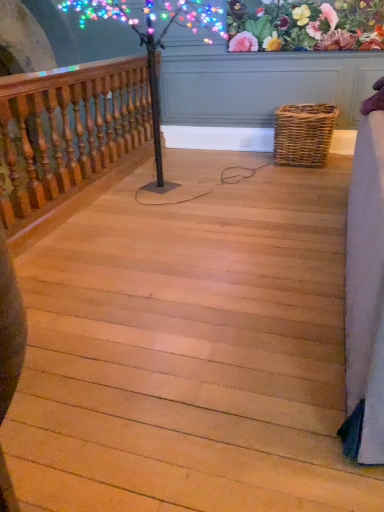
The height and width of the screenshot is (512, 384). What do you see at coordinates (190, 354) in the screenshot?
I see `light wood stairs at center` at bounding box center [190, 354].

What do you see at coordinates (303, 134) in the screenshot? I see `woven brown picnic basket at lower right` at bounding box center [303, 134].

Measure the distance between point (324, 31) and camera.

A distance of 3.51 meters exists between point (324, 31) and camera.

Locate an element on the screen. The image size is (384, 512). light wood stairs at center is located at coordinates (190, 354).

Based on the photo, which of these two, floral fabric at upper center or woven brown picnic basket at lower right, is thinner?

With smaller width is floral fabric at upper center.

Considering the sizes of objects floral fabric at upper center and woven brown picnic basket at lower right in the image provided, who is smaller, floral fabric at upper center or woven brown picnic basket at lower right?

Smaller between the two is floral fabric at upper center.

Visually, is floral fabric at upper center positioned to the left or to the right of woven brown picnic basket at lower right?

floral fabric at upper center is to the left of woven brown picnic basket at lower right.

Does woven brown picnic basket at lower right appear on the left side of wooden baluster at left?

No, woven brown picnic basket at lower right is not to the left of wooden baluster at left.

From the image's perspective, does woven brown picnic basket at lower right appear higher than wooden baluster at left?

Correct, woven brown picnic basket at lower right appears higher than wooden baluster at left in the image.

Considering the positions of objects woven brown picnic basket at lower right and wooden baluster at left in the image provided, who is behind, woven brown picnic basket at lower right or wooden baluster at left?

woven brown picnic basket at lower right is further away from the camera.

Is woven brown picnic basket at lower right wider than wooden baluster at left?

Indeed, woven brown picnic basket at lower right has a greater width compared to wooden baluster at left.

Can you confirm if wooden baluster at left is wider than light wood stairs at center?

No.

Identify the location of stairs in front of the wooden baluster at left. The height and width of the screenshot is (512, 384). (190, 354).

How many degrees apart are the facing directions of floral fabric at upper center and light wood stairs at center?

The angular difference between floral fabric at upper center and light wood stairs at center is 0.713 degrees.

Based on the photo, is floral fabric at upper center not close to light wood stairs at center?

floral fabric at upper center is far away from light wood stairs at center.

Is floral fabric at upper center inside the boundaries of light wood stairs at center, or outside?

floral fabric at upper center cannot be found inside light wood stairs at center.

In the image, is floral fabric at upper center on the left side or the right side of light wood stairs at center?

From the image, it's evident that floral fabric at upper center is to the right of light wood stairs at center.

What are the coordinates of `picnic basket above the wooden baluster at left (from the image's perspective)` in the screenshot? It's located at (303, 134).

From a real-world perspective, between wooden baluster at left and woven brown picnic basket at lower right, who is vertically higher?

In real-world perspective, wooden baluster at left is above.

How different are the orientations of wooden baluster at left and woven brown picnic basket at lower right in degrees?

The facing directions of wooden baluster at left and woven brown picnic basket at lower right are 1.46 degrees apart.

In the image, is wooden baluster at left positioned in front of or behind woven brown picnic basket at lower right?

Visually, wooden baluster at left is located in front of woven brown picnic basket at lower right.

Is light wood stairs at center facing towards woven brown picnic basket at lower right?

No, light wood stairs at center does not turn towards woven brown picnic basket at lower right.

Are light wood stairs at center and woven brown picnic basket at lower right located far from each other?

light wood stairs at center is far away from woven brown picnic basket at lower right.

Can you confirm if light wood stairs at center is positioned to the right of woven brown picnic basket at lower right?

In fact, light wood stairs at center is to the left of woven brown picnic basket at lower right.

Is floral fabric at upper center closer to camera compared to wooden baluster at left?

No, the depth of floral fabric at upper center is greater than that of wooden baluster at left.

Who is shorter, floral fabric at upper center or wooden baluster at left?

Standing shorter between the two is floral fabric at upper center.

How far apart are floral fabric at upper center and wooden baluster at left?

floral fabric at upper center is 5.02 feet from wooden baluster at left.

From a real-world perspective, which object rests below the other?

In real-world perspective, wooden baluster at left is lower.

The width and height of the screenshot is (384, 512). What are the coordinates of `picnic basket below the floral fabric at upper center (from the image's perspective)` in the screenshot? It's located at (303, 134).

The height and width of the screenshot is (512, 384). In the image, there is a wooden baluster at left. What are the coordinates of `picnic basket below it (from a real-world perspective)` in the screenshot? It's located at (303, 134).

Based on the photo, which object lies further to the anchor point floral fabric at upper center, wooden baluster at left or woven brown picnic basket at lower right?

The object further to floral fabric at upper center is wooden baluster at left.

Which object lies further to the anchor point wooden baluster at left, light wood stairs at center or floral fabric at upper center?

floral fabric at upper center is further to wooden baluster at left.

When comparing their distances from floral fabric at upper center, does woven brown picnic basket at lower right or light wood stairs at center seem further?

light wood stairs at center lies further to floral fabric at upper center than the other object.

Considering their positions, is woven brown picnic basket at lower right positioned further to wooden baluster at left than light wood stairs at center?

Based on the image, woven brown picnic basket at lower right appears to be further to wooden baluster at left.

Looking at the image, which one is located closer to light wood stairs at center, woven brown picnic basket at lower right or wooden baluster at left?

wooden baluster at left is positioned closer to the anchor light wood stairs at center.

Looking at this image, estimate the real-world distances between objects in this image. Which object is further from floral fabric at upper center, light wood stairs at center or woven brown picnic basket at lower right?

light wood stairs at center lies further to floral fabric at upper center than the other object.

When comparing their distances from woven brown picnic basket at lower right, does floral fabric at upper center or wooden baluster at left seem closer?

Among the two, floral fabric at upper center is located nearer to woven brown picnic basket at lower right.

From the image, which object appears to be nearer to woven brown picnic basket at lower right, light wood stairs at center or floral fabric at upper center?

The object closer to woven brown picnic basket at lower right is floral fabric at upper center.

Image resolution: width=384 pixels, height=512 pixels. Identify the location of floral arrangement between wooden baluster at left and woven brown picnic basket at lower right in the horizontal direction. (305, 25).

The image size is (384, 512). What are the coordinates of `rail between light wood stairs at center and floral fabric at upper center in the front-back direction` in the screenshot? It's located at 68,130.

I want to click on rail located between light wood stairs at center and woven brown picnic basket at lower right in the depth direction, so click(x=68, y=130).

Where is `floral arrangement positioned between light wood stairs at center and woven brown picnic basket at lower right from near to far`? The width and height of the screenshot is (384, 512). floral arrangement positioned between light wood stairs at center and woven brown picnic basket at lower right from near to far is located at coordinates (305, 25).